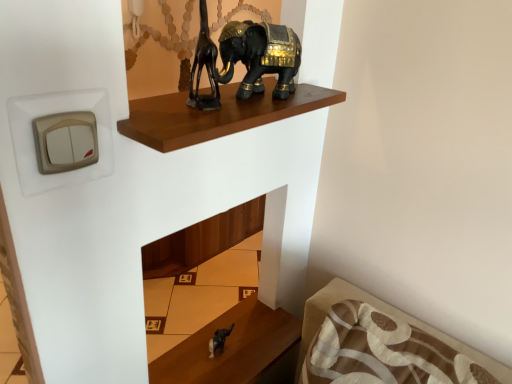
The image size is (512, 384). In order to click on free point below brown polished wood shelf at upper center (from a real-world perspective) in this screenshot , I will do `click(245, 354)`.